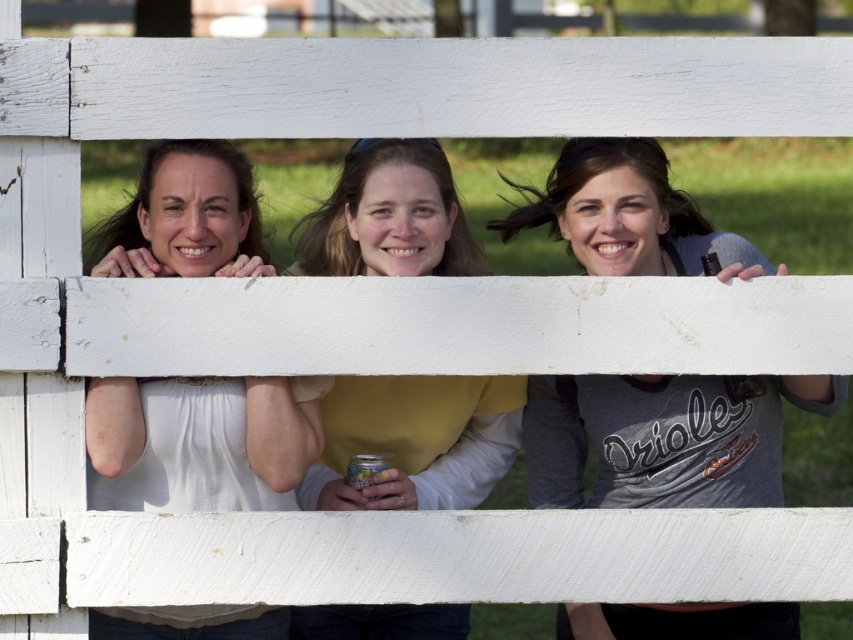
Can you confirm if white matte shirt at upper left is taller than yellow matte shirt at center?

In fact, white matte shirt at upper left may be shorter than yellow matte shirt at center.

Between white matte shirt at upper left and yellow matte shirt at center, which one appears on the left side from the viewer's perspective?

From the viewer's perspective, white matte shirt at upper left appears more on the left side.

Who is more distant from viewer, (196, 195) or (506, 376)?

The point (506, 376) is more distant.

Identify the location of white matte shirt at upper left. (200, 442).

The image size is (853, 640). Describe the element at coordinates (664, 436) in the screenshot. I see `gray matte shirt at center` at that location.

Does point (622, 161) come behind point (471, 397)?

No, (622, 161) is closer to viewer.

Identify the location of gray matte shirt at center. Image resolution: width=853 pixels, height=640 pixels. (664, 436).

In the scene shown: Can you confirm if gray matte shirt at center is positioned to the left of white matte shirt at upper left?

In fact, gray matte shirt at center is to the right of white matte shirt at upper left.

Is gray matte shirt at center below white matte shirt at upper left?

Yes.

Between point (572, 634) and point (164, 627), which one is positioned behind?

Point (572, 634)

At what (x,y) coordinates should I click in order to perform the action: click on gray matte shirt at center. Please return your answer as a coordinate pair (x, y). The height and width of the screenshot is (640, 853). Looking at the image, I should click on (664, 436).